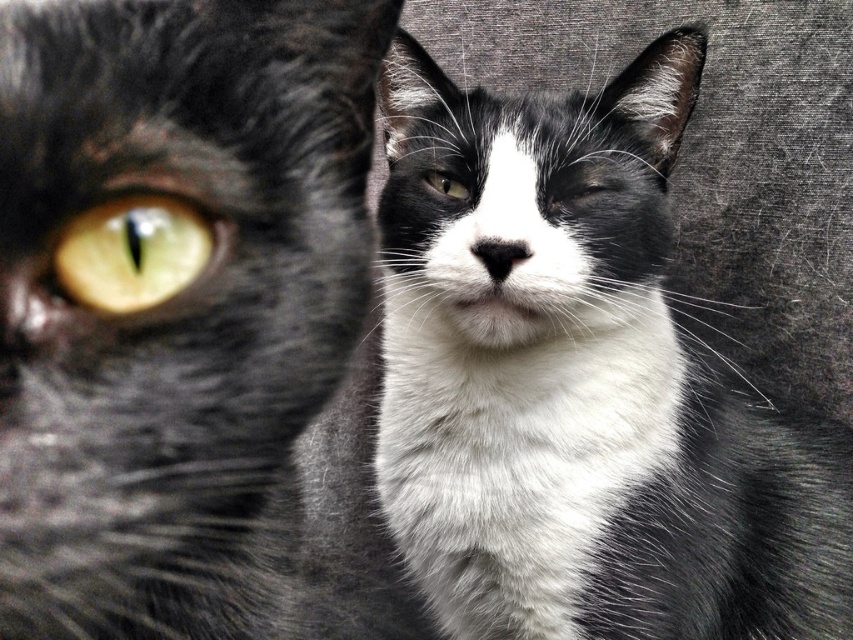
Question: Which object appears closest to the camera in this image?

Choices:
 (A) green glossy eye at center
 (B) black and white fur cat at center
 (C) matte black eye at center

Answer: (B)

Question: Which point is farther from the camera taking this photo?

Choices:
 (A) (463, 195)
 (B) (585, 196)
 (C) (590, 202)
 (D) (213, 208)

Answer: (B)

Question: In this image, where is yellow-green eye at left located relative to matte black eye at center?

Choices:
 (A) below
 (B) above

Answer: (A)

Question: Which point is farther to the camera?

Choices:
 (A) (604, 179)
 (B) (54, 234)

Answer: (A)

Question: Is shiny black fur at left thinner than matte black eye at center?

Choices:
 (A) yes
 (B) no

Answer: (B)

Question: Is shiny black fur at left above green glossy eye at center?

Choices:
 (A) no
 (B) yes

Answer: (A)